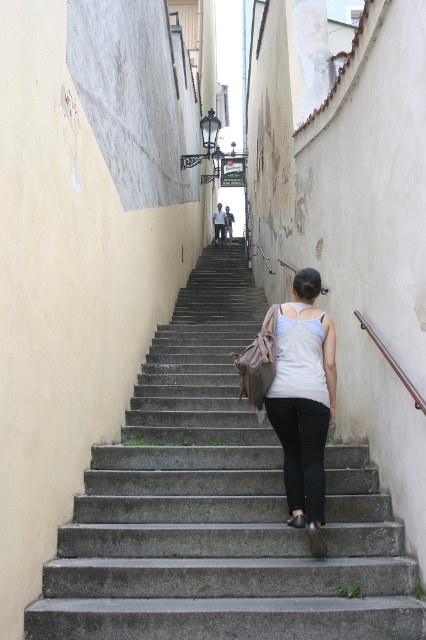
Question: Can you confirm if gray concrete stairs at center is positioned below white matte tank top at center?

Choices:
 (A) yes
 (B) no

Answer: (A)

Question: Which point is closer to the camera?

Choices:
 (A) gray concrete stairs at center
 (B) white matte tank top at center

Answer: (A)

Question: Can you confirm if gray concrete stairs at center is wider than white matte tank top at center?

Choices:
 (A) yes
 (B) no

Answer: (A)

Question: Which point is closer to the camera?

Choices:
 (A) (276, 333)
 (B) (238, 620)

Answer: (B)

Question: Can you confirm if gray concrete stairs at center is thinner than white matte tank top at center?

Choices:
 (A) yes
 (B) no

Answer: (B)